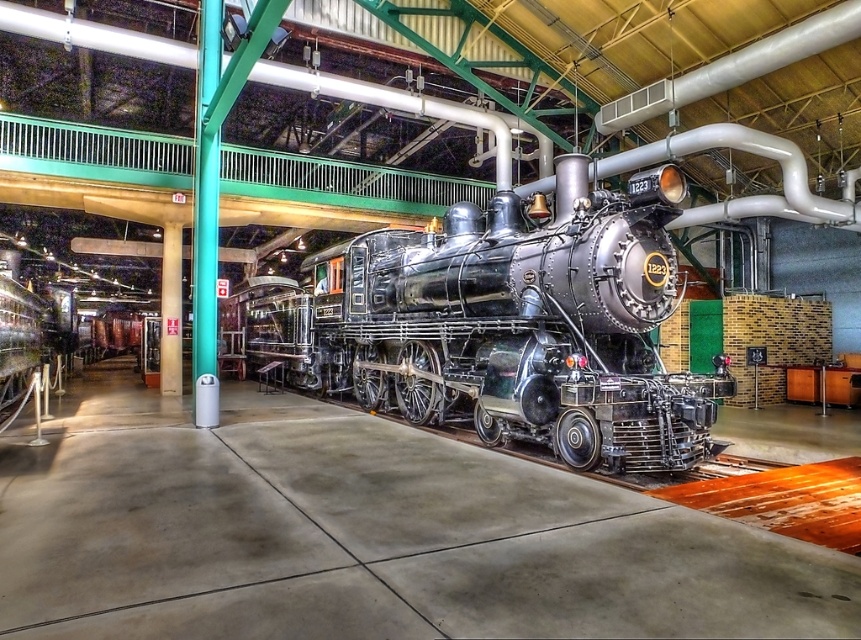
Question: Which object is closer to the camera taking this photo?

Choices:
 (A) matte silver pipe at center
 (B) teal glossy pole at center
 (C) polished steel steam locomotive at center

Answer: (C)

Question: Observing the image, what is the correct spatial positioning of teal glossy pole at center in reference to matte silver pipe at center?

Choices:
 (A) below
 (B) above

Answer: (B)

Question: Is teal glossy pole at center bigger than matte silver pipe at center?

Choices:
 (A) no
 (B) yes

Answer: (A)

Question: Which point is farther from the camera taking this photo?

Choices:
 (A) (461, 204)
 (B) (215, 337)

Answer: (B)

Question: Can you confirm if teal glossy pole at center is bigger than matte silver pipe at center?

Choices:
 (A) yes
 (B) no

Answer: (B)

Question: Which object appears farthest from the camera in this image?

Choices:
 (A) teal glossy pole at center
 (B) matte silver pipe at center

Answer: (B)